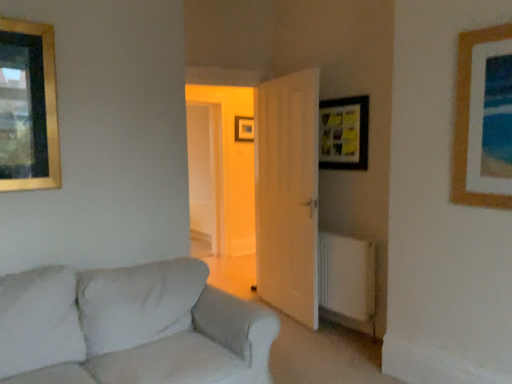
Question: From a real-world perspective, does wooden picture frame at upper right, marked as the first picture frame in a front-to-back arrangement, stand above white fabric couch at lower left?

Choices:
 (A) yes
 (B) no

Answer: (A)

Question: Does wooden picture frame at upper right, the 4th picture frame positioned from the back, have a greater height compared to white fabric couch at lower left?

Choices:
 (A) no
 (B) yes

Answer: (B)

Question: From the image's perspective, would you say wooden picture frame at upper right, which appears as the first picture frame when viewed from the right, is positioned over white fabric couch at lower left?

Choices:
 (A) yes
 (B) no

Answer: (A)

Question: Considering the relative sizes of wooden picture frame at upper right, marked as the first picture frame in a front-to-back arrangement, and white fabric couch at lower left in the image provided, is wooden picture frame at upper right, marked as the first picture frame in a front-to-back arrangement, smaller than white fabric couch at lower left?

Choices:
 (A) yes
 (B) no

Answer: (A)

Question: Is wooden picture frame at upper right, the 4th picture frame positioned from the back, located outside white fabric couch at lower left?

Choices:
 (A) no
 (B) yes

Answer: (B)

Question: Is wooden picture frame at upper right, marked as the first picture frame in a front-to-back arrangement, surrounding white fabric couch at lower left?

Choices:
 (A) no
 (B) yes

Answer: (A)

Question: Is white fabric couch at lower left positioned with its back to wooden picture frame at center, arranged as the second picture frame when viewed from the left?

Choices:
 (A) yes
 (B) no

Answer: (B)

Question: Could wooden picture frame at center, arranged as the second picture frame when viewed from the left, be considered to be inside white fabric couch at lower left?

Choices:
 (A) no
 (B) yes

Answer: (A)

Question: From a real-world perspective, is white fabric couch at lower left on top of wooden picture frame at center, the 4th picture frame in the front-to-back sequence?

Choices:
 (A) yes
 (B) no

Answer: (B)

Question: Does white fabric couch at lower left turn towards wooden picture frame at center, which ranks as the third picture frame in right-to-left order?

Choices:
 (A) yes
 (B) no

Answer: (B)

Question: Can you confirm if white fabric couch at lower left is positioned to the right of wooden picture frame at center, the 1th picture frame when ordered from back to front?

Choices:
 (A) yes
 (B) no

Answer: (B)

Question: Is white fabric couch at lower left taller than wooden picture frame at center, which ranks as the third picture frame in right-to-left order?

Choices:
 (A) no
 (B) yes

Answer: (B)

Question: Is the position of gold-framed picture at upper left, which ranks as the 2th picture frame in front-to-back order, less distant than that of white plastic radiator at lower right?

Choices:
 (A) yes
 (B) no

Answer: (A)